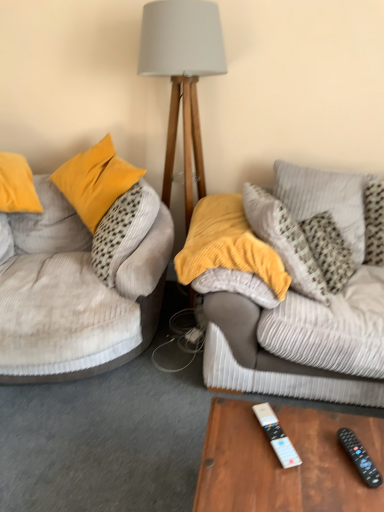
Identify the location of free location to the left of black plastic remote control at lower right, the first remote control when ordered from right to left. The width and height of the screenshot is (384, 512). (305, 463).